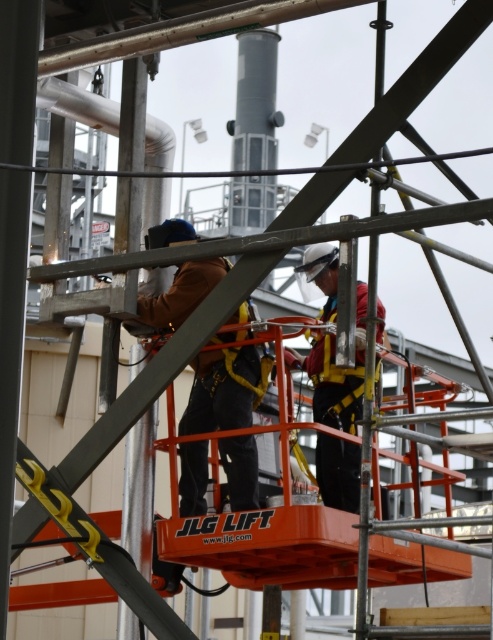
Does point (199, 369) come behind point (317, 403)?

No, (199, 369) is in front of (317, 403).

Between brown leather jacket at center and matte white helmet at center, which one has less height?

brown leather jacket at center

Who is more forward, (211, 280) or (350, 456)?

Point (350, 456)

This screenshot has width=493, height=640. Find the location of `brown leather jacket at center`. brown leather jacket at center is located at coordinates (221, 390).